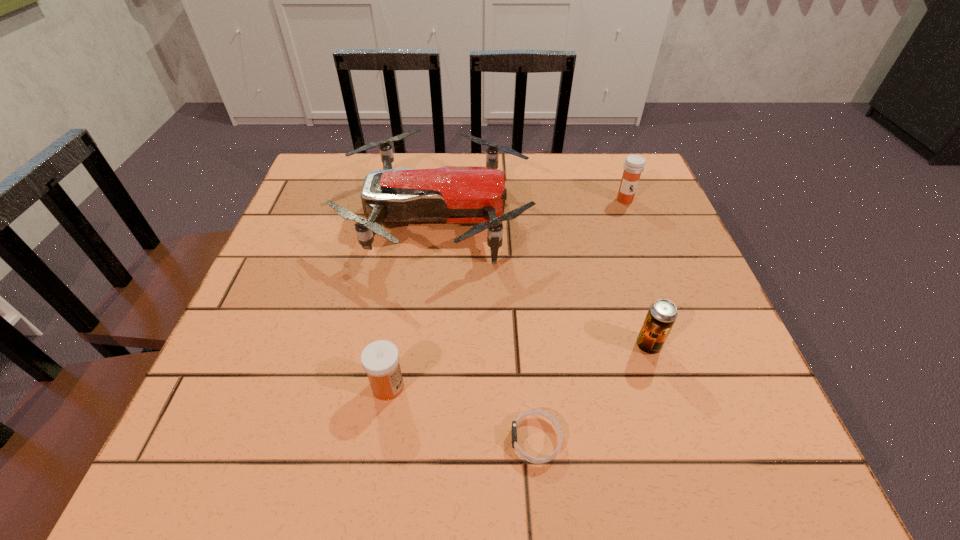
Locate an element on the screen. Image resolution: width=960 pixels, height=540 pixels. drone is located at coordinates (453, 194).

Locate an element on the screen. The width and height of the screenshot is (960, 540). the farther medicine is located at coordinates (634, 165).

I want to click on the right medicine, so click(634, 165).

The height and width of the screenshot is (540, 960). Find the location of `the third farthest object`. the third farthest object is located at coordinates (662, 314).

Image resolution: width=960 pixels, height=540 pixels. I want to click on the second object from right to left, so click(662, 314).

Locate an element on the screen. This screenshot has width=960, height=540. the nearer medicine is located at coordinates (380, 359).

Locate an element on the screen. This screenshot has width=960, height=540. the shorter medicine is located at coordinates (380, 359).

Locate an element on the screen. Image resolution: width=960 pixels, height=540 pixels. wristband is located at coordinates (540, 412).

Where is `the shortest object`? the shortest object is located at coordinates (540, 412).

This screenshot has height=540, width=960. What are the coordinates of `free region located on the front-facing side of the drone` in the screenshot? It's located at (589, 217).